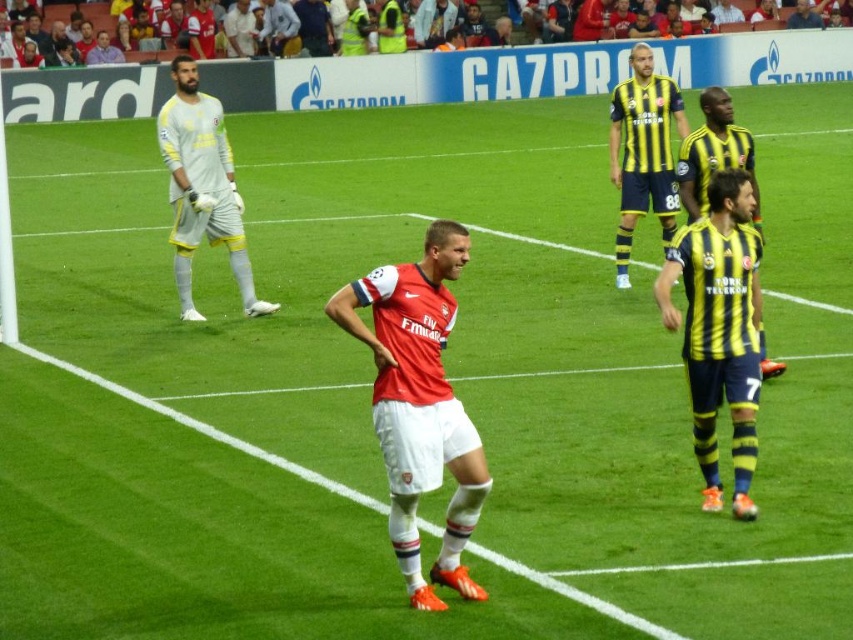
You are a soccer referee positioned at the edge of the field. You need to determine the position of the matte red jersey at center and the yellow striped jersey at center relative to each other. Which one is on the left side?

The matte red jersey at center is to the left of the yellow striped jersey at center.